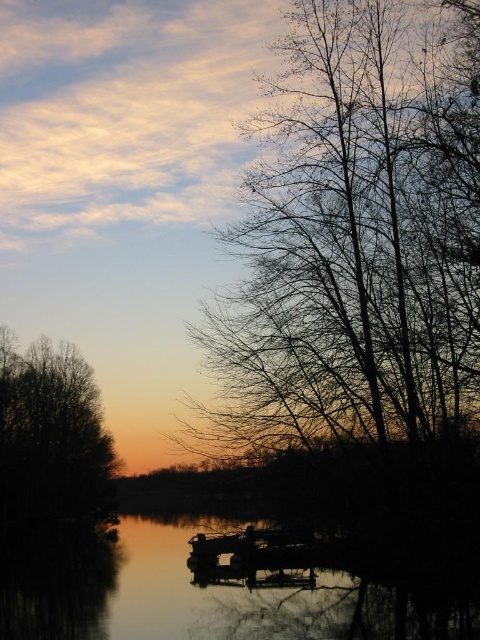
From the picture: Which of these two, silhouette bare branches at right or brown leafless tree at left, stands taller?

Standing taller between the two is silhouette bare branches at right.

Does silhouette bare branches at right appear on the left side of brown leafless tree at left?

In fact, silhouette bare branches at right is to the right of brown leafless tree at left.

Does point (446, 240) come closer to viewer compared to point (107, 477)?

Yes, it is.

This screenshot has height=640, width=480. Find the location of `silhouette bare branches at right`. silhouette bare branches at right is located at coordinates (350, 250).

Who is taller, silhouette bare branches at right or silky smooth water at center?

With more height is silhouette bare branches at right.

Is point (370, 326) more distant than point (171, 528)?

That is False.

Who is more distant from viewer, (412, 132) or (373, 637)?

Positioned behind is point (412, 132).

The image size is (480, 640). What are the coordinates of `silhouette bare branches at right` in the screenshot? It's located at (350, 250).

Measure the distance from silky smooth water at center to brown leafless tree at left.

silky smooth water at center is 36.15 feet away from brown leafless tree at left.

Consider the image. Can you confirm if silky smooth water at center is taller than brown leafless tree at left?

No.

The image size is (480, 640). I want to click on silky smooth water at center, so click(152, 589).